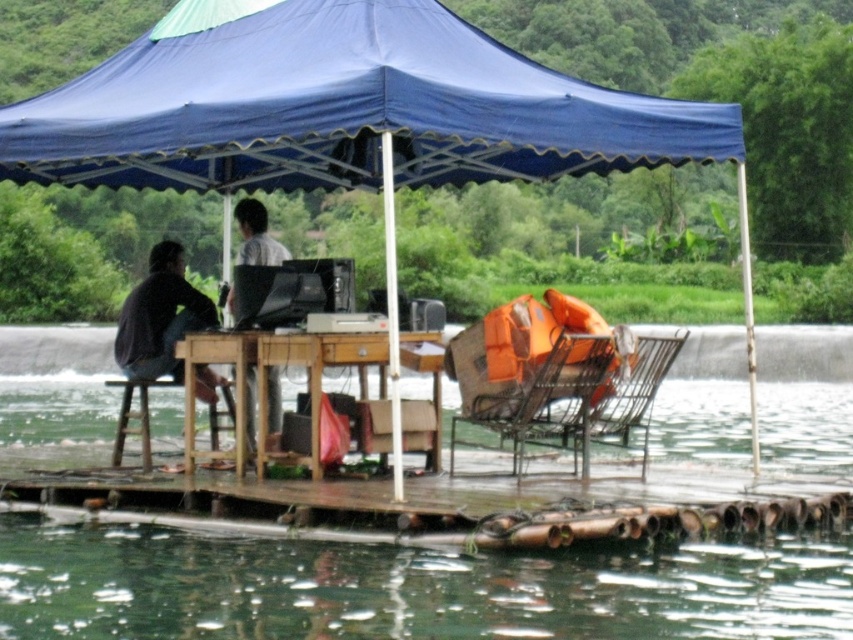
Question: Which point is closer to the camera taking this photo?

Choices:
 (A) (138, 493)
 (B) (561, 339)
 (C) (608, 394)
 (D) (247, 224)

Answer: (B)

Question: Does wooden at lower center appear on the left side of matte plastic chair at center?

Choices:
 (A) yes
 (B) no

Answer: (B)

Question: Which point is closer to the camera taking this photo?

Choices:
 (A) (585, 456)
 (B) (225, 451)

Answer: (A)

Question: Is blue fabric canopy at upper center thinner than wooden table at center?

Choices:
 (A) no
 (B) yes

Answer: (A)

Question: Which object is positioned closest to the matte plastic chair at center?

Choices:
 (A) wooden table at center
 (B) orange fabric chair at center
 (C) light gray fabric shirt at center
 (D) dark gray shirt at left

Answer: (A)

Question: Can you confirm if wooden at lower center is positioned below orange fabric chair at center?

Choices:
 (A) yes
 (B) no

Answer: (A)